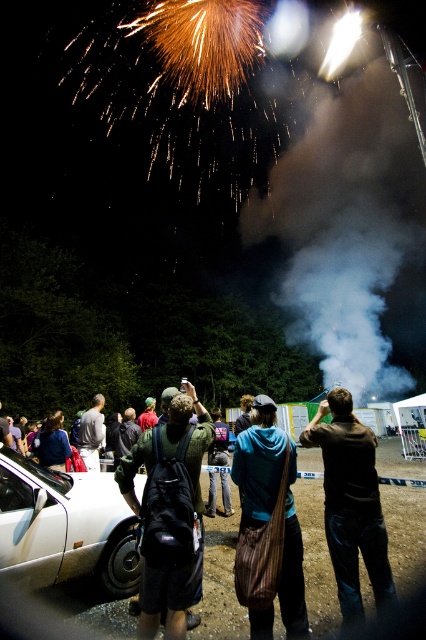
Between black backpack at center and blue cotton hoodie at center, which one has more height?

black backpack at center is taller.

Can you confirm if black backpack at center is positioned below blue cotton hoodie at center?

Actually, black backpack at center is above blue cotton hoodie at center.

This screenshot has width=426, height=640. What do you see at coordinates (170, 449) in the screenshot?
I see `black backpack at center` at bounding box center [170, 449].

The width and height of the screenshot is (426, 640). In order to click on black backpack at center in this screenshot , I will do click(170, 449).

Between white matte car at lower left and denim jacket at center, which one has more height?

Standing taller between the two is denim jacket at center.

Is point (48, 541) closer to camera compared to point (215, 499)?

Yes.

Which is behind, point (51, 536) or point (210, 444)?

Point (210, 444)

The width and height of the screenshot is (426, 640). In order to click on white matte car at lower left in this screenshot , I will do `click(65, 528)`.

Is blue cotton hoodie at center shorter than denim jacket at center?

Correct, blue cotton hoodie at center is not as tall as denim jacket at center.

Where is `blue cotton hoodie at center`? This screenshot has height=640, width=426. blue cotton hoodie at center is located at coordinates (273, 502).